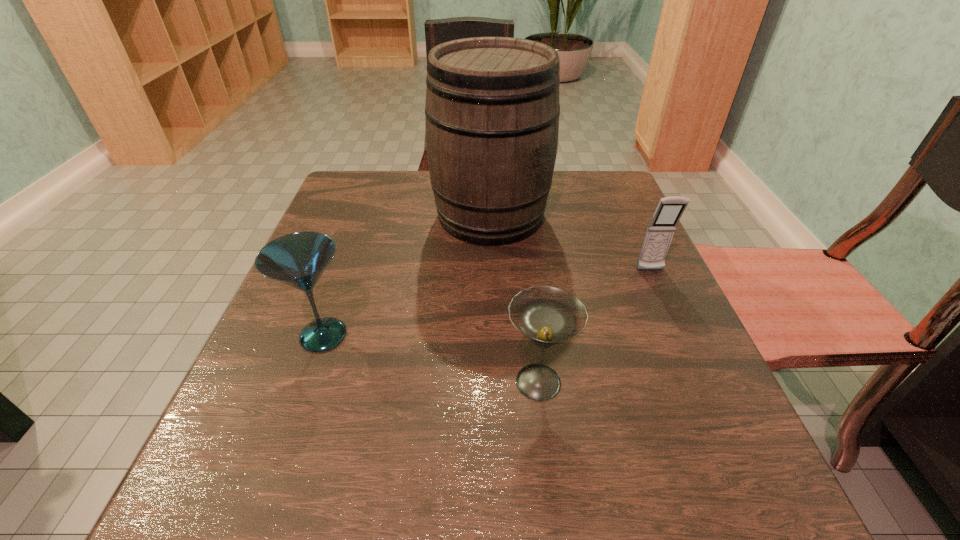
At what (x,y) coordinates should I click in order to perform the action: click on vacant area that lies between the farthest object and the rightmost object. Please return your answer as a coordinate pair (x, y). Looking at the image, I should click on pyautogui.click(x=570, y=243).

Identify the location of vacant space that is in between the tallest object and the leftmost object. (407, 275).

You are a GUI agent. You are given a task and a screenshot of the screen. Output one action in this format:
    pyautogui.click(x=<x>, y=<y>)
    Task: Click on the blank region between the tallest object and the third nearest object
    
    Given the screenshot: What is the action you would take?
    pyautogui.click(x=570, y=243)

The image size is (960, 540). I want to click on empty space that is in between the farthest object and the cellular telephone, so click(x=570, y=243).

Where is `free area in between the leftmost object and the right martini`? Image resolution: width=960 pixels, height=540 pixels. free area in between the leftmost object and the right martini is located at coordinates (431, 359).

Locate an element on the screen. The width and height of the screenshot is (960, 540). free point between the tallest object and the leftmost object is located at coordinates tap(407, 275).

This screenshot has width=960, height=540. Find the location of `vacant space that's between the farthest object and the leftmost object`. vacant space that's between the farthest object and the leftmost object is located at coordinates (407, 275).

This screenshot has height=540, width=960. I want to click on vacant space that is in between the leftmost object and the wine bucket, so click(407, 275).

Identify the location of free space that is in between the cellular telephone and the left martini. Image resolution: width=960 pixels, height=540 pixels. (487, 303).

At what (x,y) coordinates should I click in order to perform the action: click on object that can be found as the third closest to the right martini. Please return your answer as a coordinate pair (x, y). This screenshot has height=540, width=960. Looking at the image, I should click on (492, 110).